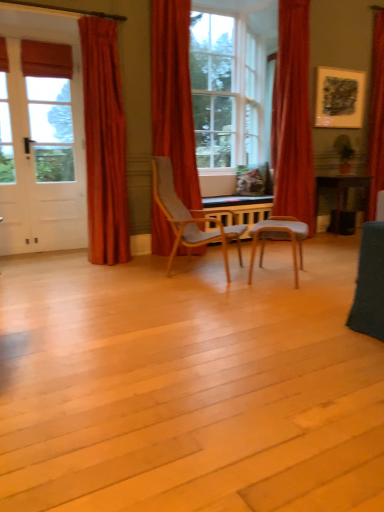
Question: Does light gray fabric chair at center, placed as the first chair when sorted from left to right, lie in front of velvet orange curtain at left, which appears as the 1th curtain when viewed from the left?

Choices:
 (A) no
 (B) yes

Answer: (B)

Question: Is light gray fabric chair at center, the 2th chair viewed from the right, further to the viewer compared to velvet orange curtain at left, the fourth curtain viewed from the right?

Choices:
 (A) no
 (B) yes

Answer: (A)

Question: Is light gray fabric chair at center, placed as the first chair when sorted from left to right, smaller than velvet orange curtain at left, the fourth curtain viewed from the right?

Choices:
 (A) yes
 (B) no

Answer: (B)

Question: Considering the relative sizes of light gray fabric chair at center, placed as the first chair when sorted from left to right, and velvet orange curtain at left, the fourth curtain viewed from the right, in the image provided, is light gray fabric chair at center, placed as the first chair when sorted from left to right, wider than velvet orange curtain at left, the fourth curtain viewed from the right,?

Choices:
 (A) no
 (B) yes

Answer: (B)

Question: From the image's perspective, is light gray fabric chair at center, placed as the first chair when sorted from left to right, beneath velvet orange curtain at left, the fourth curtain viewed from the right?

Choices:
 (A) yes
 (B) no

Answer: (A)

Question: Are light gray fabric chair at center, the 2th chair viewed from the right, and velvet orange curtain at left, the fourth curtain viewed from the right, making contact?

Choices:
 (A) yes
 (B) no

Answer: (B)

Question: Does velvet red curtain at right, the second curtain positioned from the right, turn towards matte black picture frame at upper right?

Choices:
 (A) yes
 (B) no

Answer: (B)

Question: Is velvet red curtain at right, the second curtain positioned from the right, bigger than matte black picture frame at upper right?

Choices:
 (A) no
 (B) yes

Answer: (B)

Question: Is velvet red curtain at right, the second curtain positioned from the right, outside matte black picture frame at upper right?

Choices:
 (A) yes
 (B) no

Answer: (A)

Question: From a real-world perspective, does velvet red curtain at right, the second curtain positioned from the right, sit lower than matte black picture frame at upper right?

Choices:
 (A) no
 (B) yes

Answer: (B)

Question: Considering the relative sizes of velvet red curtain at right, the 3th curtain viewed from the left, and matte black picture frame at upper right in the image provided, is velvet red curtain at right, the 3th curtain viewed from the left, wider than matte black picture frame at upper right?

Choices:
 (A) yes
 (B) no

Answer: (A)

Question: Can you confirm if velvet red curtain at right, the second curtain positioned from the right, is taller than matte black picture frame at upper right?

Choices:
 (A) no
 (B) yes

Answer: (B)

Question: Can you confirm if green matte houseplant at upper right is wider than matte glass window at center?

Choices:
 (A) yes
 (B) no

Answer: (B)